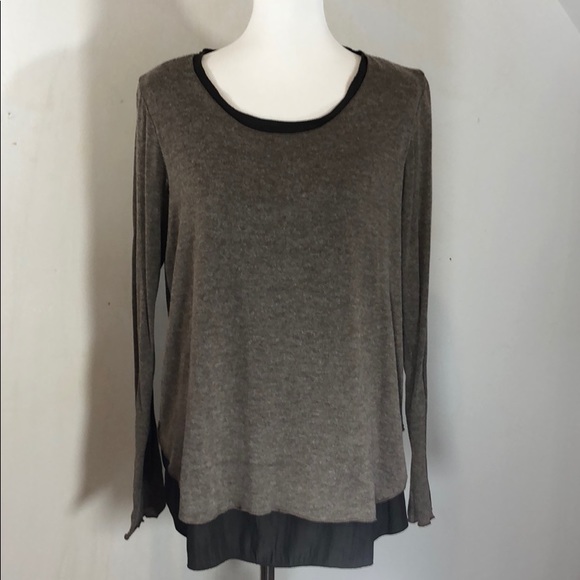
Image resolution: width=580 pixels, height=580 pixels. What are the coordinates of `white wall` in the screenshot? It's located at (503, 122).